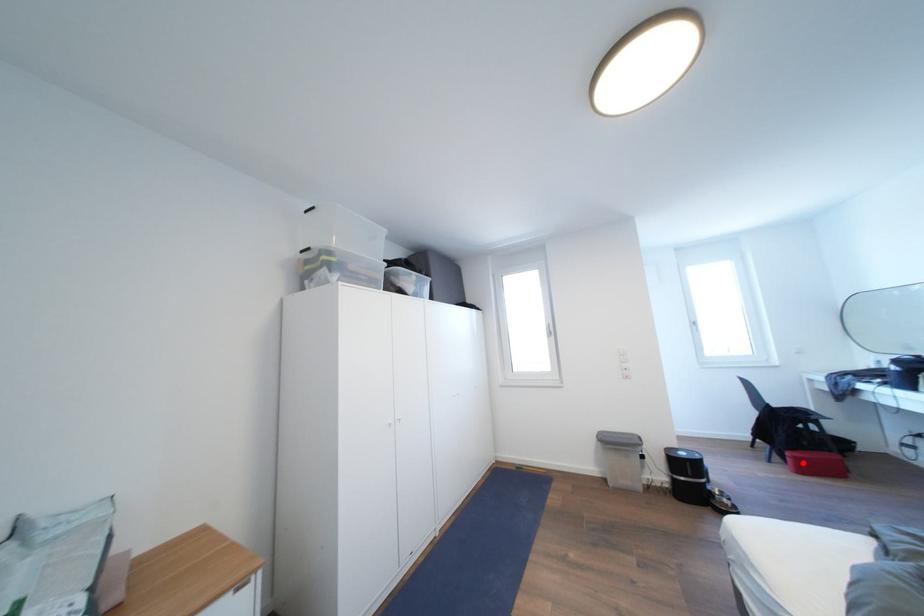
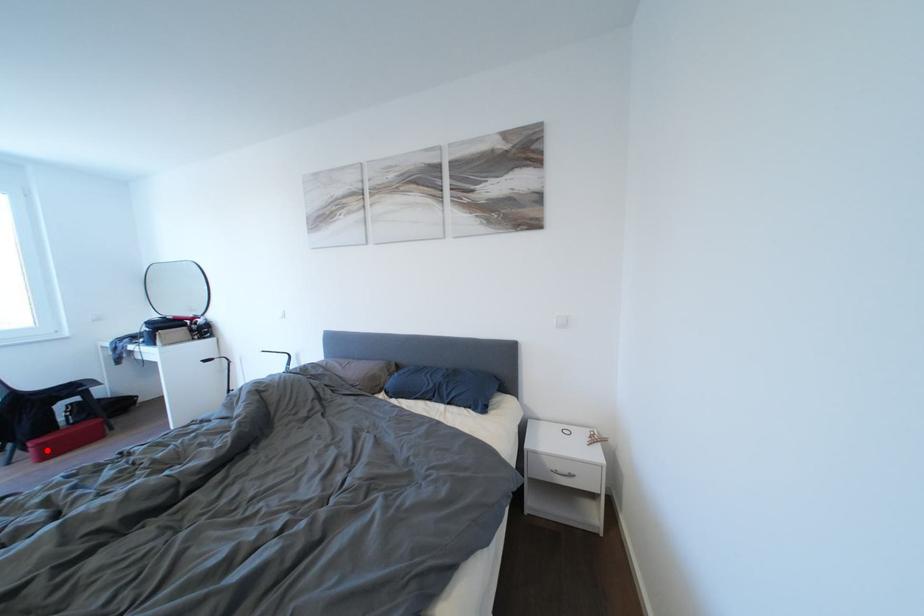
I am providing you with two images of the same scene from different viewpoints. A red point is marked on the first image and another point is marked on the second image. Is the red point in image1 aligned with the point shown in image2?

Yes